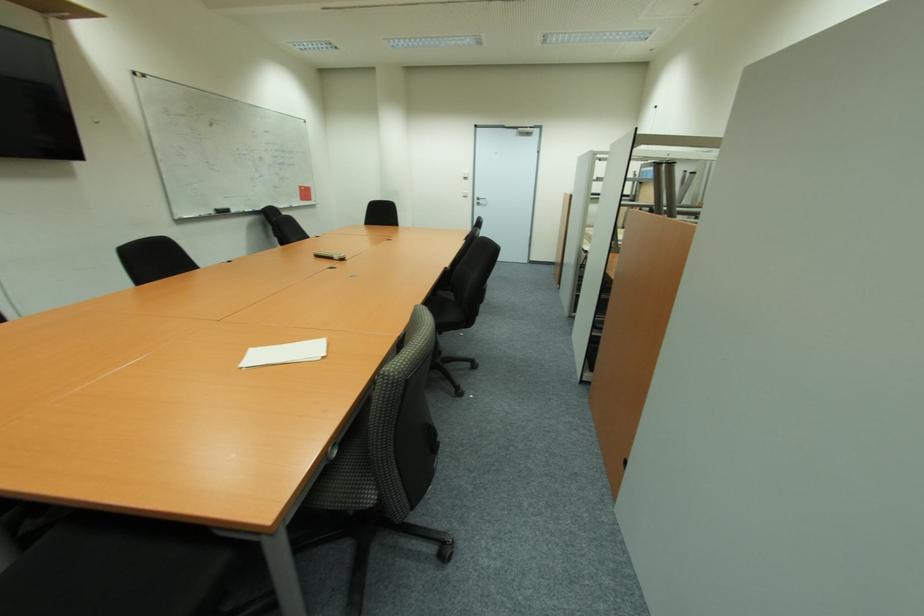
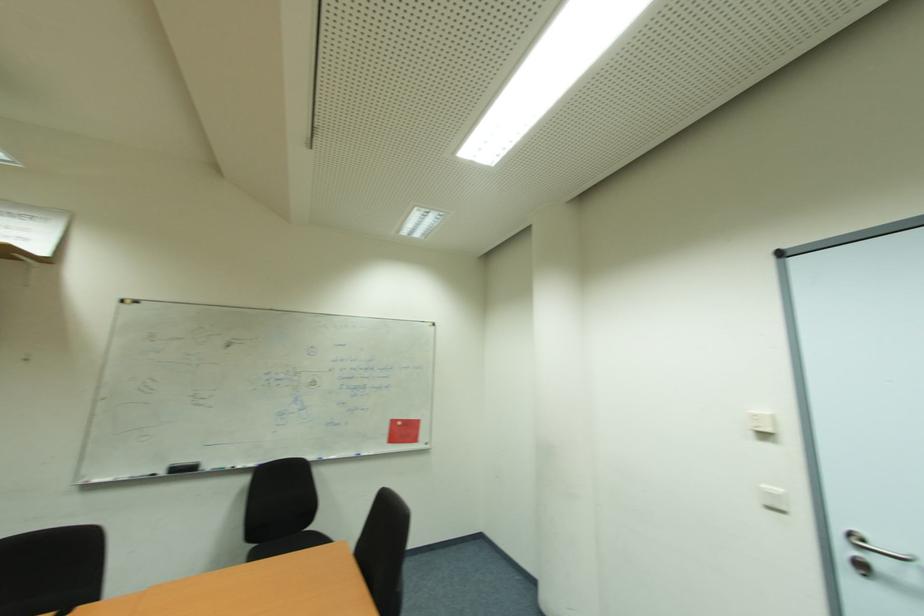
Find the pixel in the second image that matches (481,205) in the first image.

(869, 570)